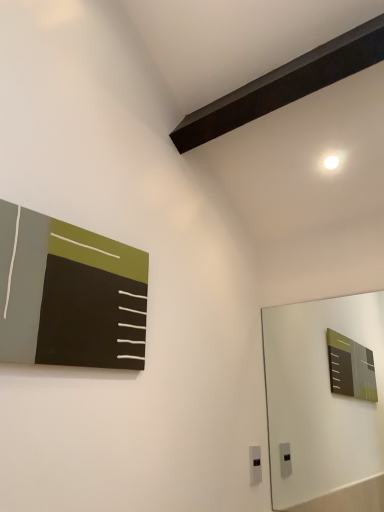
Question: Do you think black plastic electric outlet at lower center is within matte black board at upper left, or outside of it?

Choices:
 (A) inside
 (B) outside

Answer: (B)

Question: From a real-world perspective, is black plastic electric outlet at lower center physically located above or below matte black board at upper left?

Choices:
 (A) below
 (B) above

Answer: (A)

Question: Is point (251, 478) positioned closer to the camera than point (3, 334)?

Choices:
 (A) farther
 (B) closer

Answer: (A)

Question: Considering the positions of matte black board at upper left and black plastic electric outlet at lower center in the image, is matte black board at upper left taller or shorter than black plastic electric outlet at lower center?

Choices:
 (A) short
 (B) tall

Answer: (B)

Question: Considering the positions of matte black board at upper left and black plastic electric outlet at lower center in the image, is matte black board at upper left bigger or smaller than black plastic electric outlet at lower center?

Choices:
 (A) small
 (B) big

Answer: (B)

Question: Would you say matte black board at upper left is to the left or to the right of black plastic electric outlet at lower center in the picture?

Choices:
 (A) right
 (B) left

Answer: (B)

Question: Would you say matte black board at upper left is inside or outside black plastic electric outlet at lower center?

Choices:
 (A) inside
 (B) outside

Answer: (B)